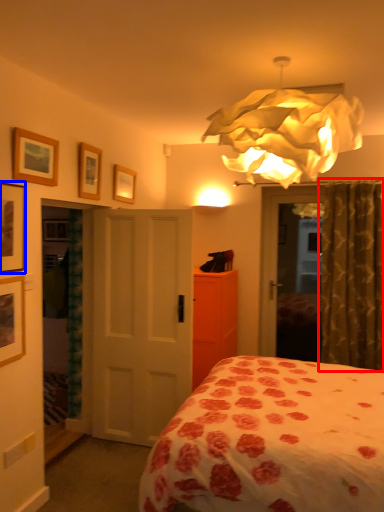
Question: Which object is further to the camera taking this photo, curtain (highlighted by a red box) or picture frame (highlighted by a blue box)?

Choices:
 (A) curtain
 (B) picture frame

Answer: (A)